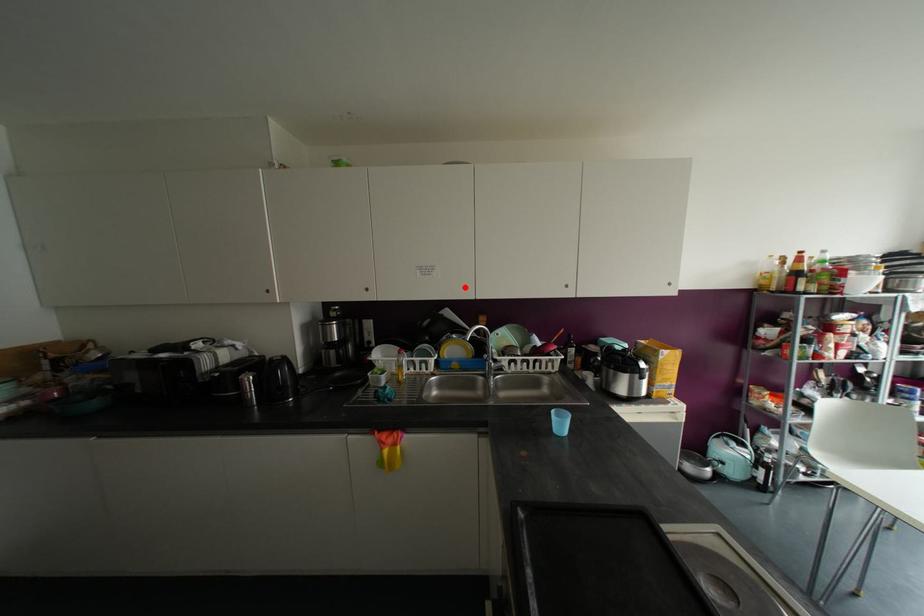
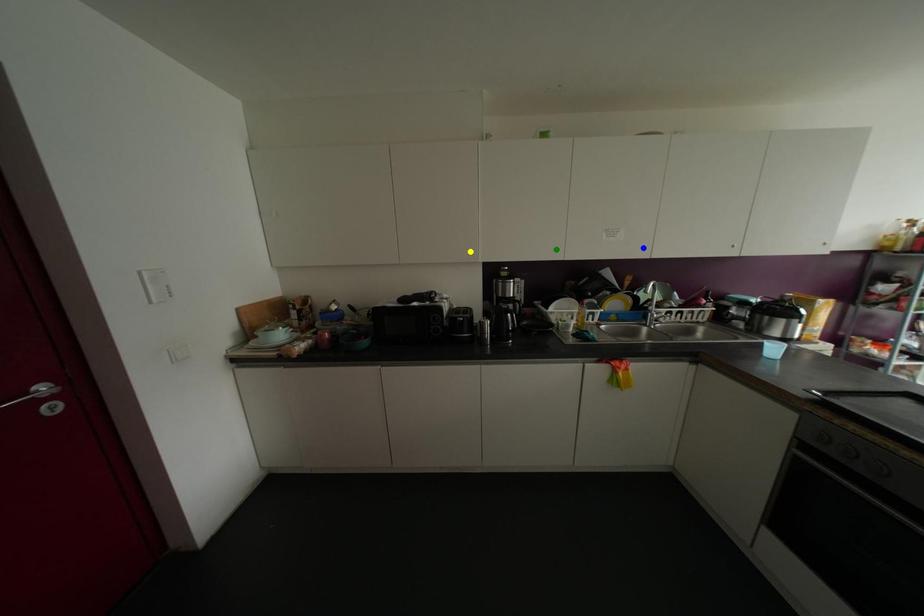
Question: I am providing you with two images of the same scene from different viewpoints. A red point is marked on the first image. You are given multiple points on the second image. Which point in image 2 represents the same 3d spot as the red point in image 1?

Choices:
 (A) yellow point
 (B) green point
 (C) blue point

Answer: (C)